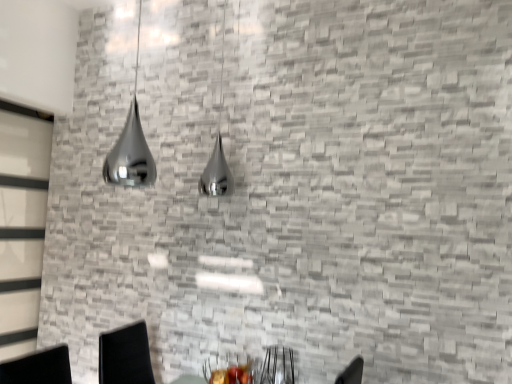
Describe the element at coordinates (277, 366) in the screenshot. The height and width of the screenshot is (384, 512). I see `metallic black armchair at lower center` at that location.

Identify the location of shiny metallic lamp at upper left. This screenshot has height=384, width=512. (131, 145).

The height and width of the screenshot is (384, 512). Find the location of `metallic black armchair at lower center`. metallic black armchair at lower center is located at coordinates (277, 366).

Where is `glass door behind the metallic black armchair at lower center`? The height and width of the screenshot is (384, 512). glass door behind the metallic black armchair at lower center is located at coordinates pos(22,223).

Considering the relative sizes of clear glass door at left and metallic black armchair at lower center in the image provided, is clear glass door at left taller than metallic black armchair at lower center?

Indeed, clear glass door at left has a greater height compared to metallic black armchair at lower center.

Visually, is clear glass door at left positioned to the left or to the right of metallic black armchair at lower center?

In the image, clear glass door at left appears on the left side of metallic black armchair at lower center.

Does clear glass door at left touch metallic black armchair at lower center?

No, clear glass door at left is not touching metallic black armchair at lower center.

Considering the positions of point (134, 116) and point (289, 370), is point (134, 116) closer or farther from the camera than point (289, 370)?

Clearly, point (134, 116) is more distant from the camera than point (289, 370).

Is the surface of shiny metallic lamp at upper left in direct contact with metallic black armchair at lower center?

There is a gap between shiny metallic lamp at upper left and metallic black armchair at lower center.

How much distance is there between shiny metallic lamp at upper left and metallic black armchair at lower center?

shiny metallic lamp at upper left is 4.04 feet from metallic black armchair at lower center.

Based on their positions, is shiny metallic lamp at upper left located to the left or right of metallic black armchair at lower center?

In the image, shiny metallic lamp at upper left appears on the left side of metallic black armchair at lower center.

Can you tell me how much shiny metallic lamp at upper left and clear glass door at left differ in facing direction?

The angle between the facing direction of shiny metallic lamp at upper left and the facing direction of clear glass door at left is 93.1 degrees.

Is shiny metallic lamp at upper left turned away from clear glass door at left?

No, shiny metallic lamp at upper left's orientation is not away from clear glass door at left.

Measure the distance from shiny metallic lamp at upper left to clear glass door at left.

The distance of shiny metallic lamp at upper left from clear glass door at left is 68.22 centimeters.

Is shiny metallic lamp at upper left not inside clear glass door at left?

Indeed, shiny metallic lamp at upper left is completely outside clear glass door at left.

Which is closer, (x=270, y=376) or (x=0, y=106)?

Point (x=270, y=376) appears to be closer to the viewer than point (x=0, y=106).

Is the surface of metallic black armchair at lower center in direct contact with clear glass door at left?

metallic black armchair at lower center and clear glass door at left are clearly separated.

From the image's perspective, is metallic black armchair at lower center under clear glass door at left?

Yes, from the image's perspective, metallic black armchair at lower center is beneath clear glass door at left.

Is metallic black armchair at lower center inside or outside of clear glass door at left?

metallic black armchair at lower center is spatially situated outside clear glass door at left.

Between clear glass door at left and shiny metallic lamp at upper left, which one appears on the left side from the viewer's perspective?

Positioned to the left is clear glass door at left.

Which object is closer to the camera taking this photo, clear glass door at left or shiny metallic lamp at upper left?

Positioned in front is shiny metallic lamp at upper left.

Would you say metallic black armchair at lower center contains shiny metallic lamp at upper left?

Actually, shiny metallic lamp at upper left is outside metallic black armchair at lower center.

Is metallic black armchair at lower center shorter than shiny metallic lamp at upper left?

Correct, metallic black armchair at lower center is not as tall as shiny metallic lamp at upper left.

Is metallic black armchair at lower center facing towards shiny metallic lamp at upper left?

No, metallic black armchair at lower center is not aimed at shiny metallic lamp at upper left.

Which point is more distant from viewer, (272, 364) or (143, 137)?

Point (143, 137)

What are the coordinates of `glass door behind the metallic black armchair at lower center` in the screenshot? It's located at (22, 223).

Find the location of `armchair that appears on the right of shiny metallic lamp at upper left`. armchair that appears on the right of shiny metallic lamp at upper left is located at coordinates (277, 366).

From the image, which object appears to be nearer to shiny metallic lamp at upper left, metallic black armchair at lower center or clear glass door at left?

clear glass door at left.

Considering their positions, is metallic black armchair at lower center positioned closer to clear glass door at left than shiny metallic lamp at upper left?

Based on the image, shiny metallic lamp at upper left appears to be nearer to clear glass door at left.

Based on their spatial positions, is shiny metallic lamp at upper left or metallic black armchair at lower center further from clear glass door at left?

metallic black armchair at lower center is further to clear glass door at left.

Looking at this image, estimate the real-world distances between objects in this image. Which object is further from metallic black armchair at lower center, shiny metallic lamp at upper left or clear glass door at left?

clear glass door at left lies further to metallic black armchair at lower center than the other object.

Based on their spatial positions, is clear glass door at left or shiny metallic lamp at upper left further from metallic black armchair at lower center?

clear glass door at left.

From the image, which object appears to be nearer to shiny metallic lamp at upper left, clear glass door at left or metallic black armchair at lower center?

The object closer to shiny metallic lamp at upper left is clear glass door at left.

Locate an element on the screen. This screenshot has height=384, width=512. lamp between clear glass door at left and metallic black armchair at lower center from left to right is located at coordinates (131, 145).